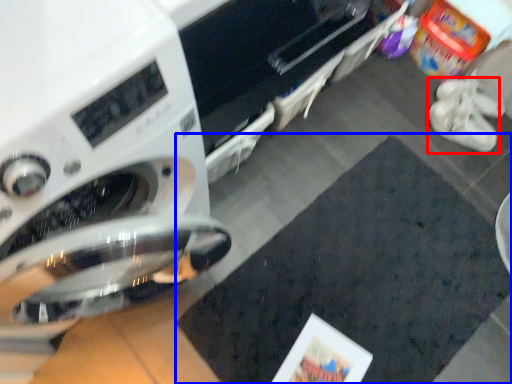
Question: Which of the following is the farthest to the observer, footwear (highlighted by a red box) or mat (highlighted by a blue box)?

Choices:
 (A) footwear
 (B) mat

Answer: (A)